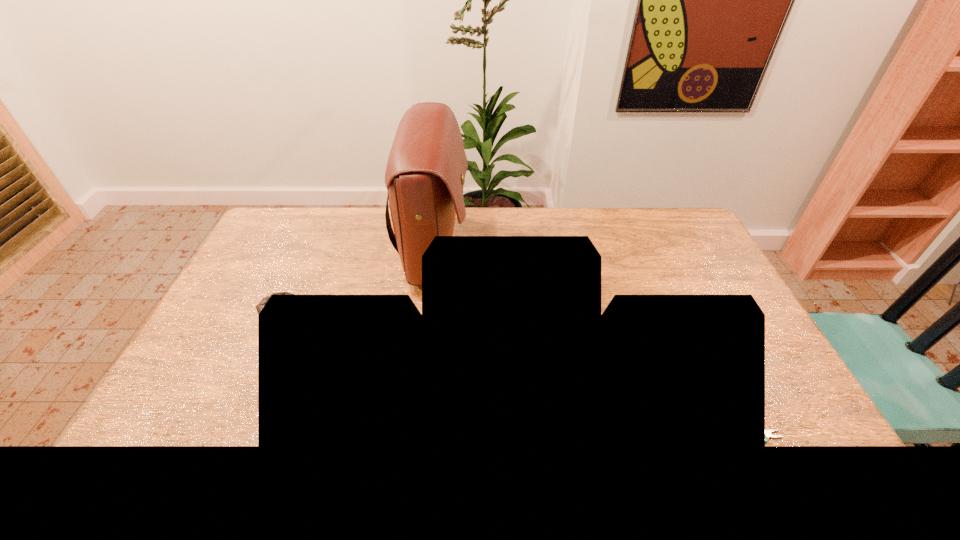
Locate an element on the screen. the tallest object is located at coordinates (425, 174).

The height and width of the screenshot is (540, 960). What are the coordinates of `the second object from right to left` in the screenshot? It's located at (425, 174).

Image resolution: width=960 pixels, height=540 pixels. In order to click on the second tallest object in this screenshot , I will do `click(259, 307)`.

Image resolution: width=960 pixels, height=540 pixels. What are the coordinates of `beanbag` in the screenshot? It's located at (259, 307).

What are the coordinates of `the rightmost object` in the screenshot? It's located at (768, 432).

Where is `pliers`? pliers is located at coordinates (768, 432).

Find the location of a particular element. The image size is (960, 540). vacant area situated on the open flap of the tallest object is located at coordinates (561, 251).

Identify the location of blank space located on the left of the leftmost object. The image size is (960, 540). (244, 315).

You are a GUI agent. You are given a task and a screenshot of the screen. Output one action in this format:
    pyautogui.click(x=<x>, y=<y>)
    Task: Click on the free space located on the right of the pliers
    The image size is (960, 540).
    Given the screenshot: What is the action you would take?
    pyautogui.click(x=803, y=436)

The height and width of the screenshot is (540, 960). What are the coordinates of `object that is at the far edge` in the screenshot? It's located at (425, 174).